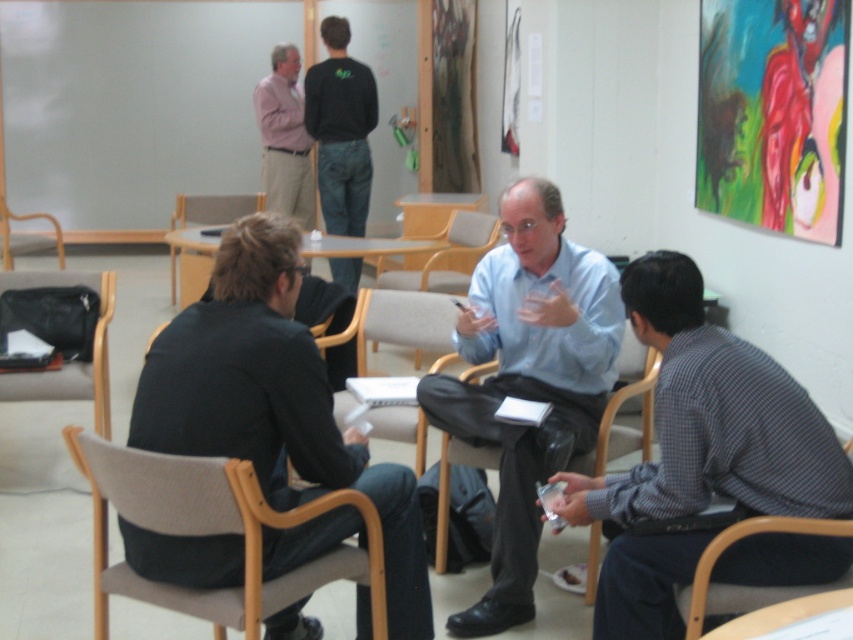
Is light blue shirt at center to the right of light gray fabric chair at center from the viewer's perspective?

Correct, you'll find light blue shirt at center to the right of light gray fabric chair at center.

Which is more to the right, light blue shirt at center or light gray fabric chair at center?

light blue shirt at center is more to the right.

This screenshot has height=640, width=853. What do you see at coordinates (527, 380) in the screenshot? I see `light blue shirt at center` at bounding box center [527, 380].

The width and height of the screenshot is (853, 640). What are the coordinates of `light blue shirt at center` in the screenshot? It's located at (527, 380).

Can you confirm if checkered shirt at center is smaller than black leather chair at lower left?

No, checkered shirt at center is not smaller than black leather chair at lower left.

Does point (596, 483) lie in front of point (80, 284)?

Yes, it is.

Locate an element on the screen. The image size is (853, 640). checkered shirt at center is located at coordinates (712, 419).

Who is lower down, dark gray suit at center or black leather chair at lower left?

dark gray suit at center

What do you see at coordinates (273, 403) in the screenshot? I see `dark gray suit at center` at bounding box center [273, 403].

Between point (305, 442) and point (48, 381), which one is positioned in front?

Point (305, 442)

I want to click on dark gray suit at center, so click(x=273, y=403).